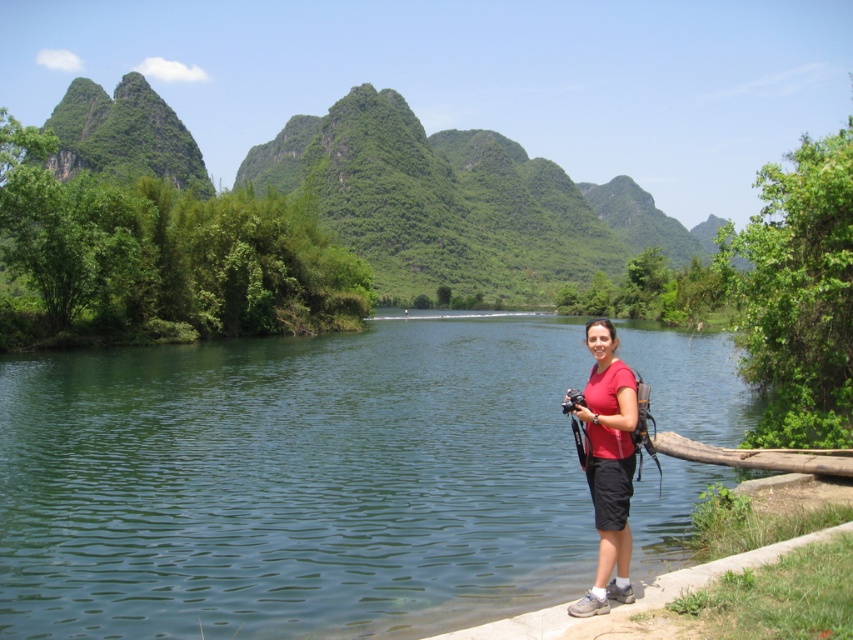
Question: From the image, what is the correct spatial relationship of green smooth water at center in relation to red matte shirt at lower right?

Choices:
 (A) left
 (B) right

Answer: (A)

Question: Is green smooth water at center to the right of red matte shirt at lower right from the viewer's perspective?

Choices:
 (A) yes
 (B) no

Answer: (B)

Question: Which object appears closest to the camera in this image?

Choices:
 (A) red matte shirt at lower right
 (B) green smooth water at center

Answer: (A)

Question: Can you confirm if green smooth water at center is positioned to the left of red matte shirt at lower right?

Choices:
 (A) no
 (B) yes

Answer: (B)

Question: Which point appears closest to the camera in this image?

Choices:
 (A) (535, 330)
 (B) (599, 525)

Answer: (B)

Question: Among these points, which one is nearest to the camera?

Choices:
 (A) (434, 522)
 (B) (573, 609)

Answer: (B)